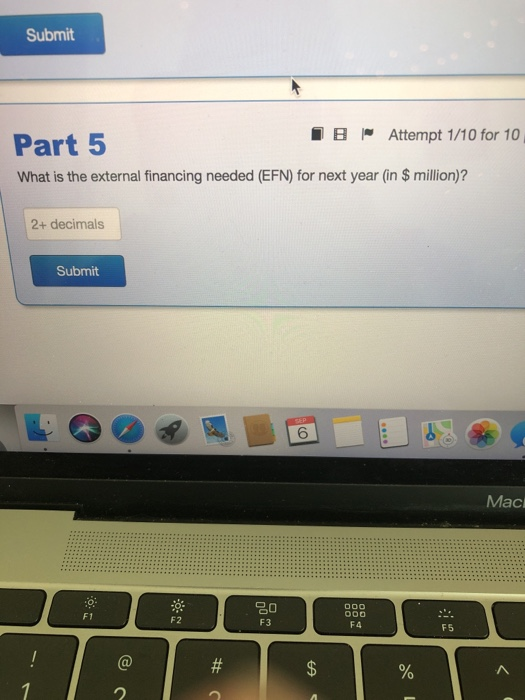
The height and width of the screenshot is (700, 525). Identify the location of laptop screen. (78, 379).